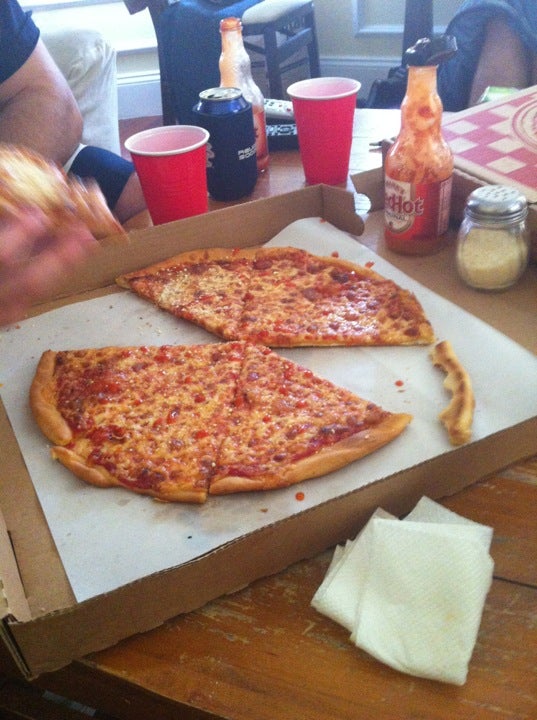
Where is `chair`? This screenshot has height=720, width=537. chair is located at coordinates (272, 11).